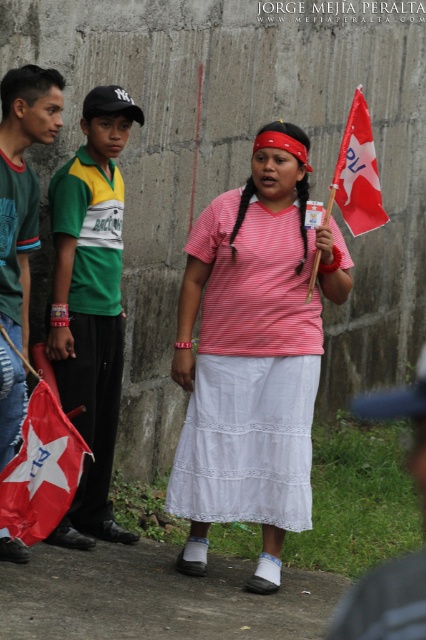
Between pink striped shirt at center and green jersey at left, which one is positioned higher?

green jersey at left is above.

Can you confirm if pink striped shirt at center is thinner than green jersey at left?

Incorrect, pink striped shirt at center's width is not less than green jersey at left's.

Between point (244, 237) and point (5, 244), which one is positioned in front?

Point (5, 244) is in front.

I want to click on pink striped shirt at center, so (x=252, y=362).

Can you confirm if green jersey at left is smaller than red fabric flag at lower left?

Incorrect, green jersey at left is not smaller in size than red fabric flag at lower left.

The image size is (426, 640). What do you see at coordinates (23, 184) in the screenshot? I see `green jersey at left` at bounding box center [23, 184].

Is point (5, 80) positioned after point (54, 461)?

Yes, it is.

Find the location of a particular element. green jersey at left is located at coordinates (23, 184).

Does green jersey at left have a lesser height compared to red fabric flag at upper right?

In fact, green jersey at left may be taller than red fabric flag at upper right.

Is green jersey at left positioned before red fabric flag at upper right?

Yes, it is in front of red fabric flag at upper right.

This screenshot has height=640, width=426. What do you see at coordinates (23, 184) in the screenshot?
I see `green jersey at left` at bounding box center [23, 184].

This screenshot has height=640, width=426. What are the coordinates of `green jersey at left` in the screenshot? It's located at (23, 184).